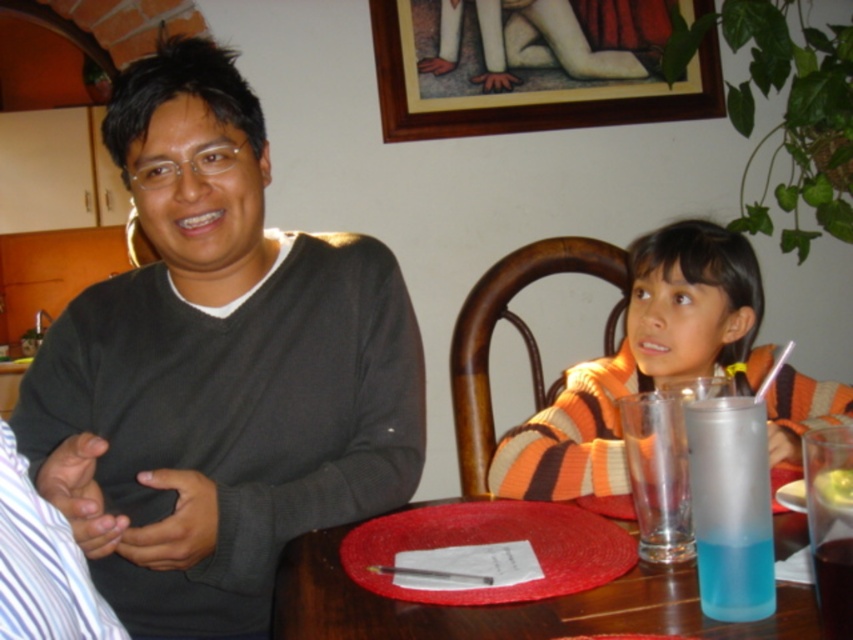
You are standing in front of the dining table. Where is the dark gray sweater at left located?

The dark gray sweater at left is located at point (218, 369).

You are a fashion designer observing two people in the image. The dark gray sweater at left and the striped sweater at center are both on display. Which one is located to the right of the other?

The dark gray sweater at left is positioned on the left side of striped sweater at center, so the striped sweater at center is to the right of the dark gray sweater at left.